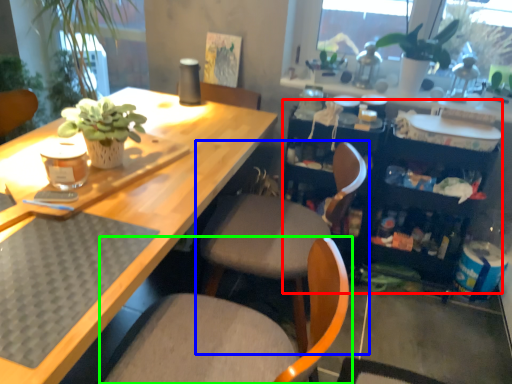
Question: Considering the real-world distances, which object is closest to bookshelf (highlighted by a red box)? chair (highlighted by a blue box) or chair (highlighted by a green box).

Choices:
 (A) chair
 (B) chair

Answer: (A)